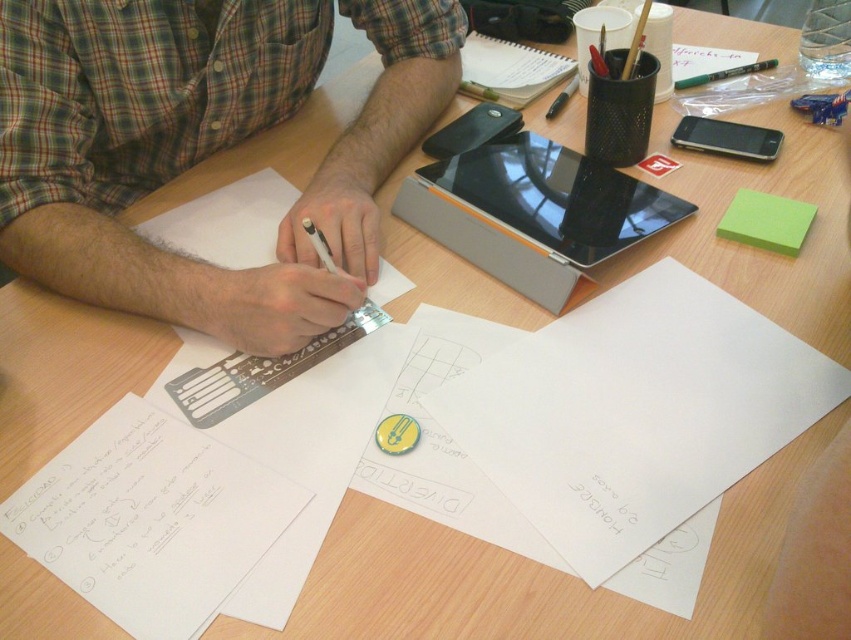
Is green plaid shirt at upper left to the left of white paper at lower left from the viewer's perspective?

Incorrect, green plaid shirt at upper left is not on the left side of white paper at lower left.

Can you confirm if green plaid shirt at upper left is wider than white paper at lower left?

Indeed, green plaid shirt at upper left has a greater width compared to white paper at lower left.

Measure the distance between point (104, 236) and camera.

The distance of point (104, 236) from camera is 67.44 centimeters.

Find the location of a particular element. This screenshot has width=851, height=640. green plaid shirt at upper left is located at coordinates (280, 221).

Is white paper at center closer to camera compared to white paper at lower left?

Yes, white paper at center is closer to the viewer.

Is white paper at center to the left of white paper at lower left from the viewer's perspective?

No, white paper at center is not to the left of white paper at lower left.

The height and width of the screenshot is (640, 851). Find the location of `white paper at center`. white paper at center is located at coordinates (634, 412).

Can you confirm if green plaid shirt at upper left is thinner than black glossy tablet at upper right?

Incorrect, green plaid shirt at upper left's width is not less than black glossy tablet at upper right's.

Looking at this image, which is above, green plaid shirt at upper left or black glossy tablet at upper right?

green plaid shirt at upper left is above.

At what (x,y) coordinates should I click in order to perform the action: click on green plaid shirt at upper left. Please return your answer as a coordinate pair (x, y). Looking at the image, I should click on (280, 221).

Where is `green plaid shirt at upper left`? green plaid shirt at upper left is located at coordinates (280, 221).